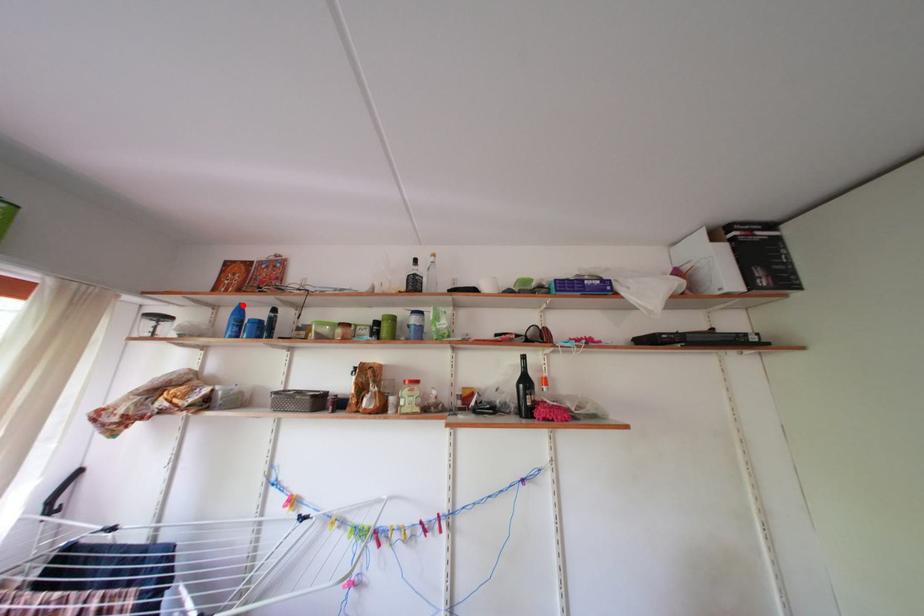
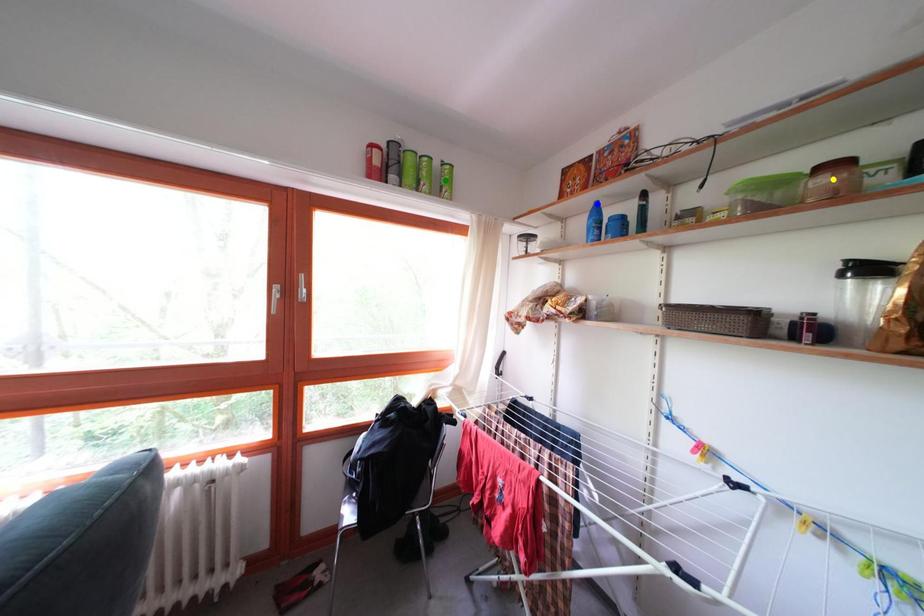
Question: I am providing you with two images of the same scene from different viewpoints. A red point is marked on the first image. You are given multiple points on the second image. Which spot in image 2 lines up with the point in image 1?

Choices:
 (A) blue point
 (B) green point
 (C) yellow point

Answer: (A)